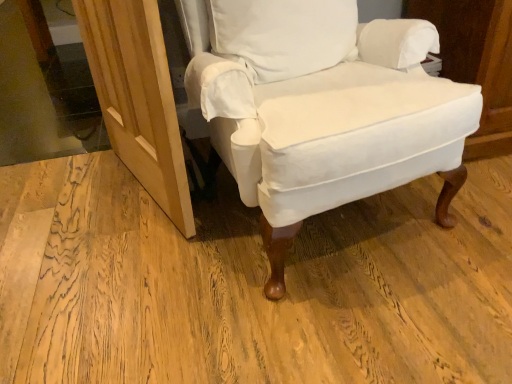
Question: Does natural wood screen door at lower left come behind white cotton chair at center?

Choices:
 (A) yes
 (B) no

Answer: (A)

Question: Does natural wood screen door at lower left appear on the left side of white cotton chair at center?

Choices:
 (A) no
 (B) yes

Answer: (B)

Question: From the image's perspective, is natural wood screen door at lower left located beneath white cotton chair at center?

Choices:
 (A) no
 (B) yes

Answer: (B)

Question: Is natural wood screen door at lower left facing away from white cotton chair at center?

Choices:
 (A) no
 (B) yes

Answer: (B)

Question: Is natural wood screen door at lower left located outside white cotton chair at center?

Choices:
 (A) no
 (B) yes

Answer: (B)

Question: Considering the relative sizes of natural wood screen door at lower left and white cotton chair at center in the image provided, is natural wood screen door at lower left wider than white cotton chair at center?

Choices:
 (A) no
 (B) yes

Answer: (A)

Question: Is transparent glass door at upper left facing towards natural wood screen door at lower left?

Choices:
 (A) no
 (B) yes

Answer: (A)

Question: From the image's perspective, would you say transparent glass door at upper left is positioned over natural wood screen door at lower left?

Choices:
 (A) yes
 (B) no

Answer: (A)

Question: Does transparent glass door at upper left have a lesser height compared to natural wood screen door at lower left?

Choices:
 (A) yes
 (B) no

Answer: (A)

Question: Can you confirm if transparent glass door at upper left is bigger than natural wood screen door at lower left?

Choices:
 (A) no
 (B) yes

Answer: (B)

Question: Can you confirm if transparent glass door at upper left is positioned to the right of natural wood screen door at lower left?

Choices:
 (A) no
 (B) yes

Answer: (A)

Question: Is transparent glass door at upper left turned away from natural wood screen door at lower left?

Choices:
 (A) yes
 (B) no

Answer: (B)

Question: Is transparent glass door at upper left not within white cotton chair at center?

Choices:
 (A) yes
 (B) no

Answer: (A)